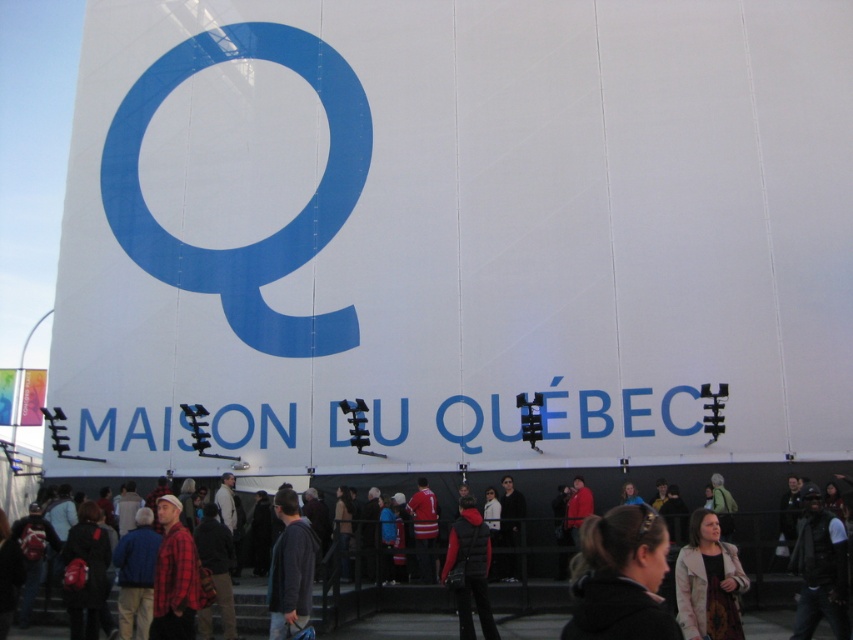
You are organizing a photo shoot at this event and need to ensure the blue glossy letter q at center is clearly visible in the background. Given that the dark blue leather jacket at lower right is worn by a participant standing close to the camera, will the jacket block the view of the letter Q?

The blue glossy letter q at center is larger in size than the dark blue leather jacket at lower right. Since the jacket is closer to the camera, it might partially block the view of the letter Q unless positioned carefully to avoid covering its larger form.

You are organizing a photo shoot at the event and need to position two models wearing the dark blue leather jacket at lower right and the dark gray sweater at center. The minimum distance required between them for the camera setup is 50 feet. Can you place them according to the requirement?

The dark blue leather jacket at lower right and dark gray sweater at center are 54.72 feet apart from each other, which exceeds the minimum required distance of 50 feet. Therefore, they can be placed as specified.

You are standing in the crowd in front of the MAISON DU QU?BEC banner and want to move towards the entrance. You notice two points marked in the scene. Which point, point (538, 564) or point (294, 600), is closer to you as you face the banner?

Point (538, 564) is further to the viewer than point (294, 600), so point (294, 600) is closer to you.